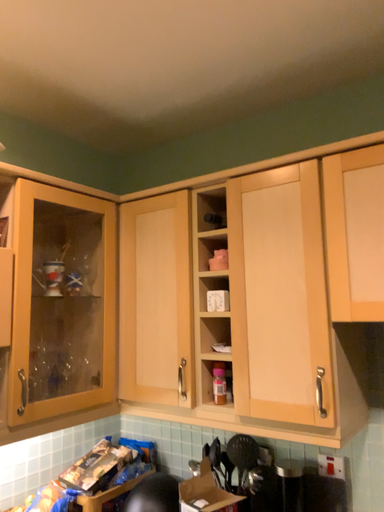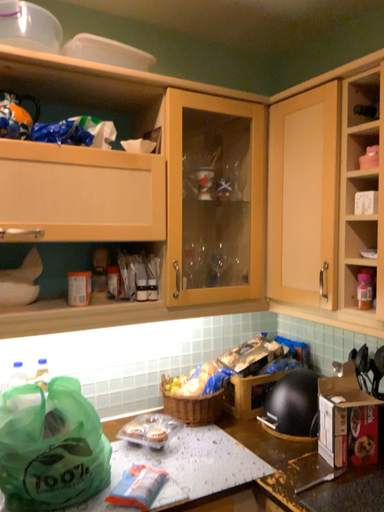
Question: How did the camera likely rotate when shooting the video?

Choices:
 (A) rotated right
 (B) rotated left

Answer: (B)